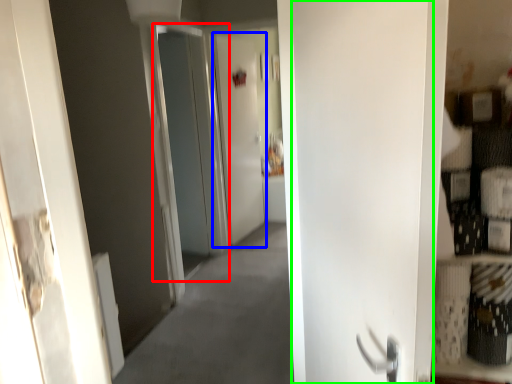
Question: Which object is the farthest from screen door (highlighted by a red box)? Choose among these: screen door (highlighted by a blue box) or door (highlighted by a green box).

Choices:
 (A) screen door
 (B) door

Answer: (B)